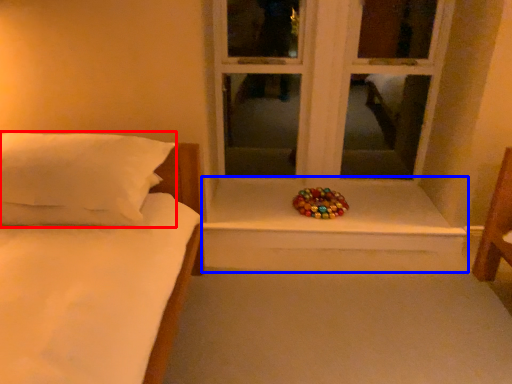
Question: Which of the following is the closest to the observer, pillow (highlighted by a red box) or window sill (highlighted by a blue box)?

Choices:
 (A) pillow
 (B) window sill

Answer: (A)